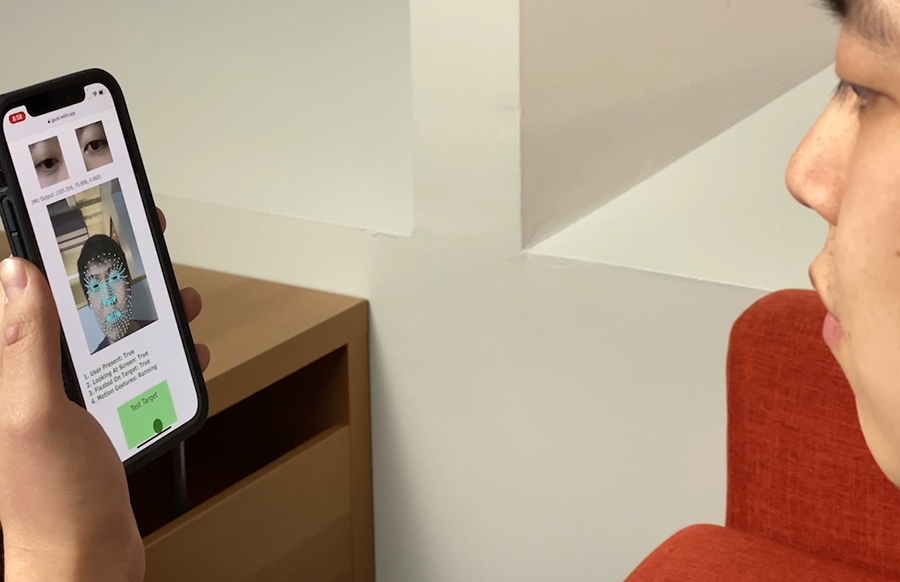
Identify the location of phone. The width and height of the screenshot is (900, 582). tap(86, 306).